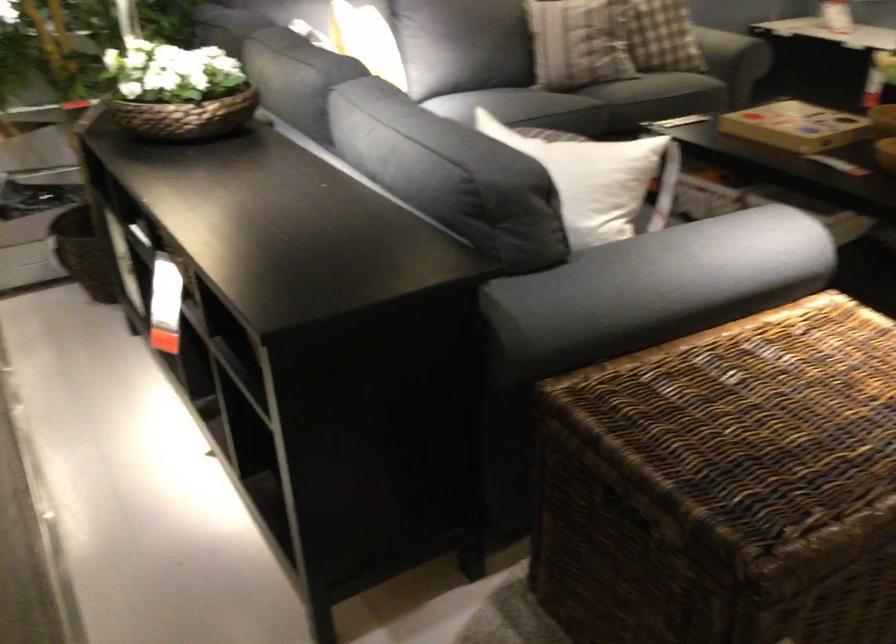
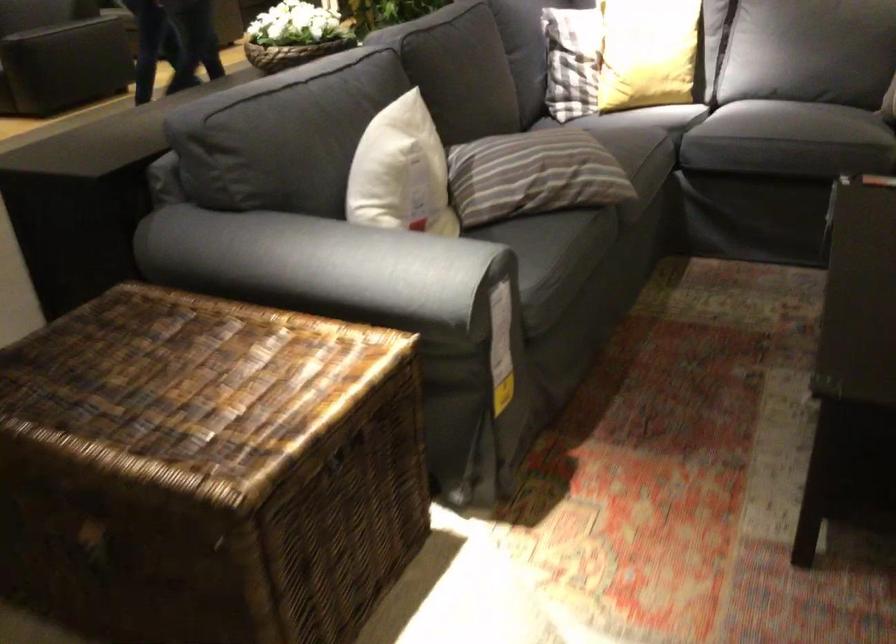
Where in the second image is the point corresponding to (x=640, y=259) from the first image?

(304, 265)